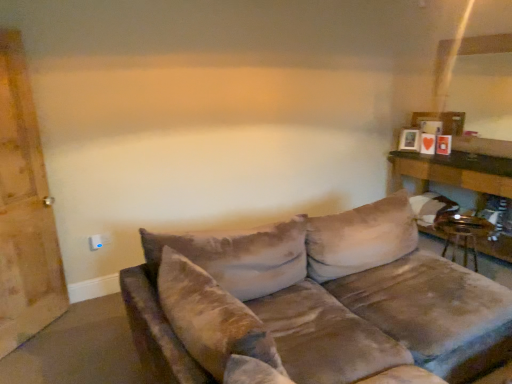
In order to click on matte wooden picture frame at upper right in this screenshot , I will do `click(409, 140)`.

The width and height of the screenshot is (512, 384). What do you see at coordinates (24, 210) in the screenshot? I see `wooden barn door at left` at bounding box center [24, 210].

In order to face wooden table at right, should I rotate leftwards or rightwards?

You should look right and rotate roughly 26.018 degrees.

Locate an element on the screen. matte wooden picture frame at upper right is located at coordinates (409, 140).

Can you tell me how much white plastic electric outlet at lower left and wooden barn door at left differ in facing direction?

44 degrees separate the facing orientations of white plastic electric outlet at lower left and wooden barn door at left.

Who is bigger, white plastic electric outlet at lower left or wooden barn door at left?

wooden barn door at left.

This screenshot has width=512, height=384. What are the coordinates of `barn door that appears above the white plastic electric outlet at lower left (from a real-world perspective)` in the screenshot? It's located at (24, 210).

Can you confirm if velvet brown couch at center is thinner than white plastic electric outlet at lower left?

No, velvet brown couch at center is not thinner than white plastic electric outlet at lower left.

From a real-world perspective, does velvet brown couch at center stand above white plastic electric outlet at lower left?

Correct, in the physical world, velvet brown couch at center is higher than white plastic electric outlet at lower left.

Is velvet brown couch at center smaller than white plastic electric outlet at lower left?

No.

Which is more to the left, velvet brown couch at center or white plastic electric outlet at lower left?

white plastic electric outlet at lower left.

Is point (429, 276) closer or farther from the camera than point (18, 130)?

Point (429, 276) is closer to the camera than point (18, 130).

From the image's perspective, would you say velvet brown couch at center is shown under wooden barn door at left?

Yes, from the image's perspective, velvet brown couch at center is below wooden barn door at left.

How different are the orientations of velvet brown couch at center and wooden barn door at left in degrees?

46 degrees.

Find the location of a particular element. This screenshot has height=384, width=512. studio couch directly beneath the wooden barn door at left (from a real-world perspective) is located at coordinates (312, 304).

Between wooden barn door at left and velvet brown couch at center, which one appears on the left side from the viewer's perspective?

wooden barn door at left is more to the left.

Is wooden barn door at left in front of or behind velvet brown couch at center in the image?

wooden barn door at left is behind velvet brown couch at center.

From the picture: Would you say wooden barn door at left is outside velvet brown couch at center?

Yes, wooden barn door at left is outside of velvet brown couch at center.

Which of these two, wooden table at right or wooden barn door at left, stands taller?

Standing taller between the two is wooden barn door at left.

From the image's perspective, which object appears higher, wooden table at right or wooden barn door at left?

wooden barn door at left.

Is wooden table at right facing towards wooden barn door at left?

Yes, wooden table at right is turned towards wooden barn door at left.

Who is smaller, wooden barn door at left or wooden table at right?

wooden barn door at left.

Consider the image. Considering the positions of objects wooden barn door at left and wooden table at right in the image provided, who is in front, wooden barn door at left or wooden table at right?

Positioned in front is wooden barn door at left.

From the picture: From a real-world perspective, is wooden barn door at left physically below wooden table at right?

No, from a real-world perspective, wooden barn door at left is not beneath wooden table at right.

In order to click on table located below the wooden barn door at left (from the image's perspective) in this screenshot , I will do (454, 173).

Is matte wooden picture frame at upper right in contact with wooden barn door at left?

No, matte wooden picture frame at upper right is not making contact with wooden barn door at left.

Is matte wooden picture frame at upper right completely or partially outside of wooden barn door at left?

matte wooden picture frame at upper right lies outside wooden barn door at left's area.

From the picture: What's the angular difference between matte wooden picture frame at upper right and wooden barn door at left's facing directions?

The angular difference between matte wooden picture frame at upper right and wooden barn door at left is 107 degrees.

Is matte wooden picture frame at upper right further to camera compared to wooden barn door at left?

Yes, it is.

In order to click on barn door that is above the white plastic electric outlet at lower left (from a real-world perspective) in this screenshot , I will do `click(24, 210)`.

You are a GUI agent. You are given a task and a screenshot of the screen. Output one action in this format:
    pyautogui.click(x=<x>, y=<y>)
    Task: Click on the studio couch lying below the white plastic electric outlet at lower left (from the image's perspective)
    
    Given the screenshot: What is the action you would take?
    312,304

Estimate the real-world distances between objects in this image. Which object is closer to white plastic electric outlet at lower left, wooden barn door at left or wooden table at right?

The object closer to white plastic electric outlet at lower left is wooden barn door at left.

Estimate the real-world distances between objects in this image. Which object is closer to matte wooden picture frame at upper right, wooden table at right or wooden barn door at left?

Based on the image, wooden table at right appears to be nearer to matte wooden picture frame at upper right.

From the image, which object appears to be nearer to white plastic electric outlet at lower left, wooden table at right or wooden barn door at left?

wooden barn door at left is closer to white plastic electric outlet at lower left.

From the image, which object appears to be farther from white plastic electric outlet at lower left, velvet brown couch at center or wooden table at right?

wooden table at right.

Considering their positions, is white plastic electric outlet at lower left positioned closer to wooden barn door at left than matte wooden picture frame at upper right?

white plastic electric outlet at lower left is closer to wooden barn door at left.

Estimate the real-world distances between objects in this image. Which object is further from velvet brown couch at center, white plastic electric outlet at lower left or matte wooden picture frame at upper right?

The object further to velvet brown couch at center is matte wooden picture frame at upper right.

Estimate the real-world distances between objects in this image. Which object is closer to velvet brown couch at center, wooden table at right or matte wooden picture frame at upper right?

wooden table at right.

Looking at the image, which one is located closer to wooden table at right, velvet brown couch at center or matte wooden picture frame at upper right?

matte wooden picture frame at upper right is closer to wooden table at right.

You are a GUI agent. You are given a task and a screenshot of the screen. Output one action in this format:
    pyautogui.click(x=<x>, y=<y>)
    Task: Click on the studio couch between white plastic electric outlet at lower left and wooden table at right from left to right
    The image size is (512, 384).
    Given the screenshot: What is the action you would take?
    pyautogui.click(x=312, y=304)

In order to click on barn door located between velvet brown couch at center and white plastic electric outlet at lower left in the depth direction in this screenshot , I will do `click(24, 210)`.

Locate an element on the screen. table between velvet brown couch at center and matte wooden picture frame at upper right along the z-axis is located at coordinates (454, 173).

You are a GUI agent. You are given a task and a screenshot of the screen. Output one action in this format:
    pyautogui.click(x=<x>, y=<y>)
    Task: Click on the picture frame between white plastic electric outlet at lower left and wooden table at right
    The width and height of the screenshot is (512, 384).
    Given the screenshot: What is the action you would take?
    pyautogui.click(x=409, y=140)